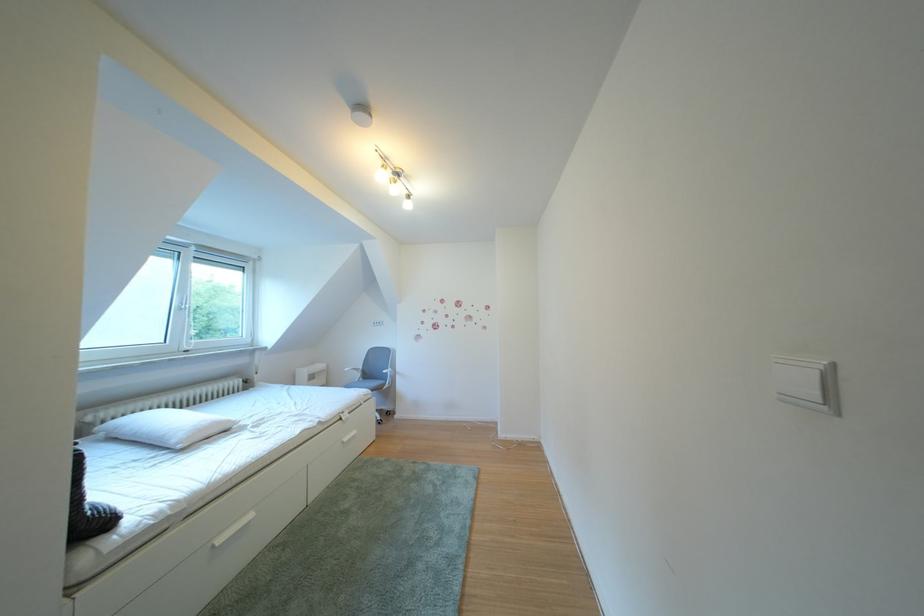
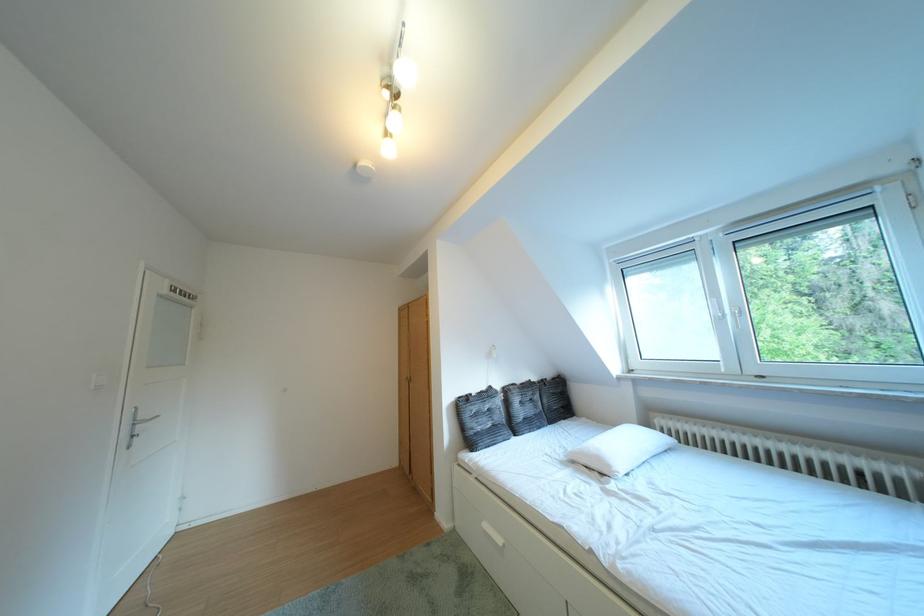
Find the pixel in the second image that matches (242,427) in the first image.

(623, 471)